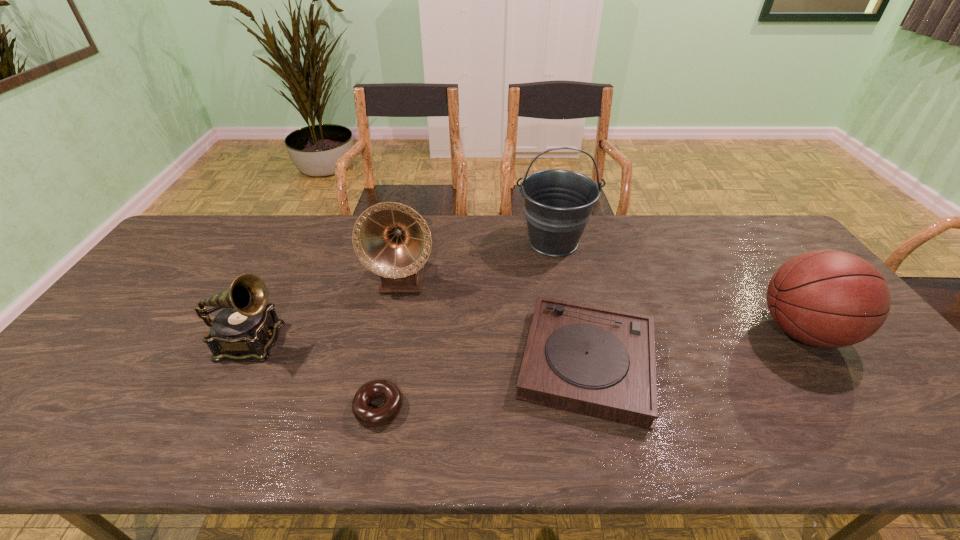
Where is `vacant area at the far left corner`? This screenshot has height=540, width=960. vacant area at the far left corner is located at coordinates (184, 231).

This screenshot has height=540, width=960. What are the coordinates of `vacant area at the far right corner of the desktop` in the screenshot? It's located at (749, 229).

Locate an element on the screen. This screenshot has height=540, width=960. vacant area that lies between the second phonograph record from left to right and the bucket is located at coordinates (478, 261).

Locate an element on the screen. The width and height of the screenshot is (960, 540). free point between the bucket and the farthest phonograph record is located at coordinates (478, 261).

The width and height of the screenshot is (960, 540). In order to click on empty location between the shortest object and the rightmost phonograph record in this screenshot , I will do `click(483, 384)`.

The image size is (960, 540). I want to click on vacant area between the shortest phonograph record and the second phonograph record from right to left, so click(494, 321).

The height and width of the screenshot is (540, 960). I want to click on vacant point located between the rightmost phonograph record and the second shortest phonograph record, so click(419, 352).

The height and width of the screenshot is (540, 960). What are the coordinates of `free area in between the second shortest phonograph record and the farthest phonograph record` in the screenshot? It's located at (326, 311).

Where is `vacant point located between the leftmost phonograph record and the shortest phonograph record`? vacant point located between the leftmost phonograph record and the shortest phonograph record is located at coordinates (419, 352).

At what (x,y) coordinates should I click in order to perform the action: click on vacant area that lies between the rightmost object and the second shortest object. Please return your answer as a coordinate pair (x, y). The height and width of the screenshot is (540, 960). Looking at the image, I should click on (694, 347).